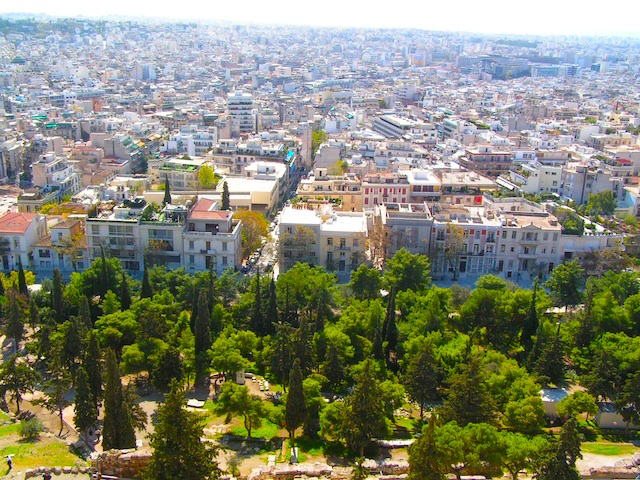
This screenshot has width=640, height=480. Find the location of `first row doorways`. first row doorways is located at coordinates (463, 268), (339, 266), (207, 264), (63, 263), (524, 265).